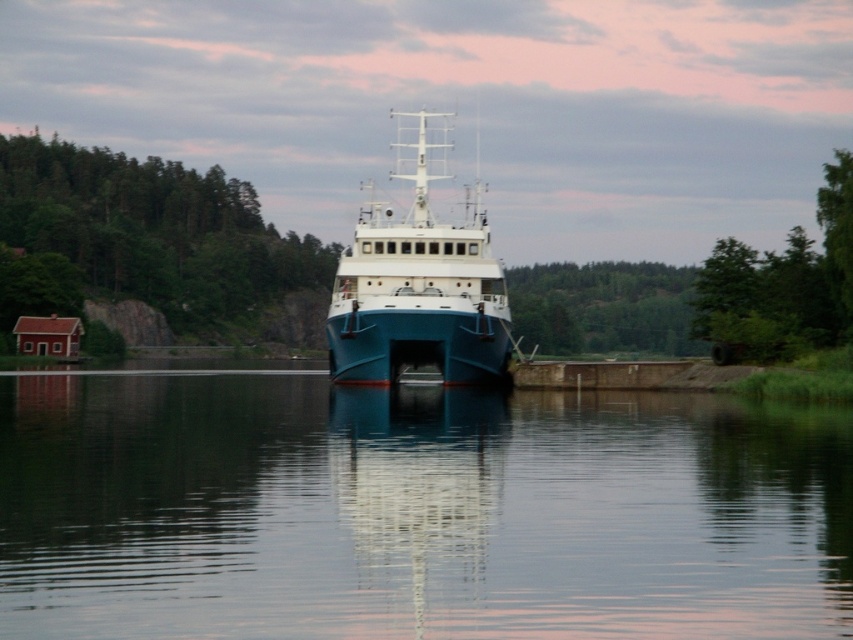
Question: Which point is farther to the camera?

Choices:
 (A) blue matte boat at center
 (B) smooth water at center

Answer: (A)

Question: Does smooth water at center come behind blue matte boat at center?

Choices:
 (A) yes
 (B) no

Answer: (B)

Question: Can you confirm if smooth water at center is wider than blue matte boat at center?

Choices:
 (A) no
 (B) yes

Answer: (B)

Question: Can you confirm if smooth water at center is positioned to the left of blue matte boat at center?

Choices:
 (A) yes
 (B) no

Answer: (B)

Question: Which object appears closest to the camera in this image?

Choices:
 (A) smooth water at center
 (B) blue matte boat at center

Answer: (A)

Question: Among these objects, which one is nearest to the camera?

Choices:
 (A) smooth water at center
 (B) blue matte boat at center

Answer: (A)